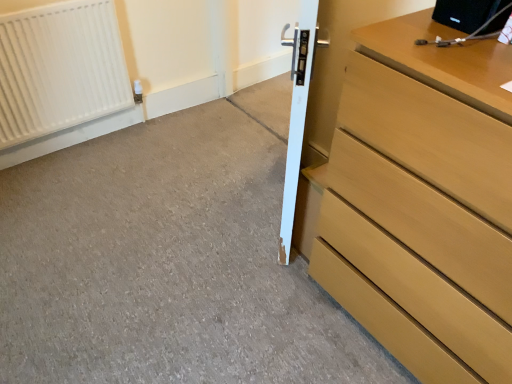
Question: Is white glossy door at center at the left side of light brown wood chest of drawers at right?

Choices:
 (A) no
 (B) yes

Answer: (B)

Question: Does white glossy door at center lie in front of light brown wood chest of drawers at right?

Choices:
 (A) no
 (B) yes

Answer: (A)

Question: Is white glossy door at center to the right of light brown wood chest of drawers at right from the viewer's perspective?

Choices:
 (A) no
 (B) yes

Answer: (A)

Question: Is white glossy door at center oriented away from light brown wood chest of drawers at right?

Choices:
 (A) yes
 (B) no

Answer: (A)

Question: Is white glossy door at center far from light brown wood chest of drawers at right?

Choices:
 (A) no
 (B) yes

Answer: (A)

Question: Considering the positions of light brown wood chest of drawers at right and white glossy door at center in the image, is light brown wood chest of drawers at right taller or shorter than white glossy door at center?

Choices:
 (A) tall
 (B) short

Answer: (B)

Question: From the image's perspective, is light brown wood chest of drawers at right above or below white glossy door at center?

Choices:
 (A) below
 (B) above

Answer: (A)

Question: Considering the positions of light brown wood chest of drawers at right and white glossy door at center in the image, is light brown wood chest of drawers at right wider or thinner than white glossy door at center?

Choices:
 (A) wide
 (B) thin

Answer: (A)

Question: In terms of size, does light brown wood chest of drawers at right appear bigger or smaller than white glossy door at center?

Choices:
 (A) big
 (B) small

Answer: (A)

Question: In terms of width, does smooth concrete at center look wider or thinner when compared to white glossy door at center?

Choices:
 (A) thin
 (B) wide

Answer: (B)

Question: Would you say smooth concrete at center is to the left or to the right of white glossy door at center in the picture?

Choices:
 (A) right
 (B) left

Answer: (B)

Question: Is smooth concrete at center in front of or behind white glossy door at center in the image?

Choices:
 (A) front
 (B) behind

Answer: (A)

Question: From a real-world perspective, is smooth concrete at center above or below white glossy door at center?

Choices:
 (A) above
 (B) below

Answer: (B)

Question: From a real-world perspective, relative to smooth concrete at center, is light brown wood chest of drawers at right vertically above or below?

Choices:
 (A) above
 (B) below

Answer: (A)

Question: From the image's perspective, is light brown wood chest of drawers at right located above or below smooth concrete at center?

Choices:
 (A) below
 (B) above

Answer: (B)